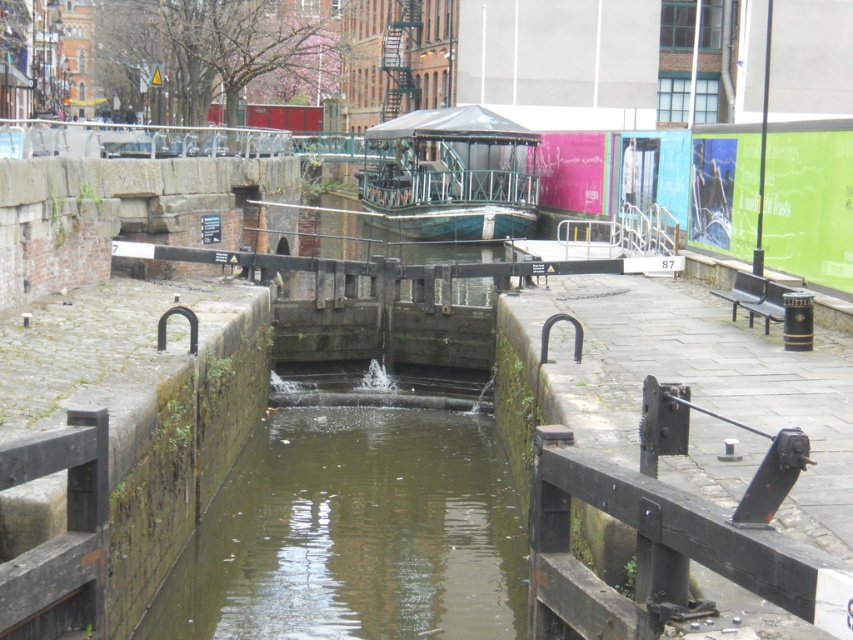
You are a boat operator navigating through the canal lock system. You notice two points marked on your map corresponding to coordinates in the scene. The first point is at point (195, 628) and the second is at point (517, 172). Based on the scene description, which point is closer to the entrance of the lock system?

Point (195, 628) is closer to the entrance of the lock system because it is in front of point (517, 172).

You are a boat operator trying to navigate through the canal lock system. You notice the greenish concrete water at center and the green matte boat at center. Which object takes up more space in the scene?

The green matte boat at center takes up more space than the greenish concrete water at center.

You are a boat operator trying to navigate through the canal lock. You see the greenish concrete water at center and the green matte boat at center. Which object is closer to you as you approach the lock?

The greenish concrete water at center is closer to you because it is positioned in front of the green matte boat at center.